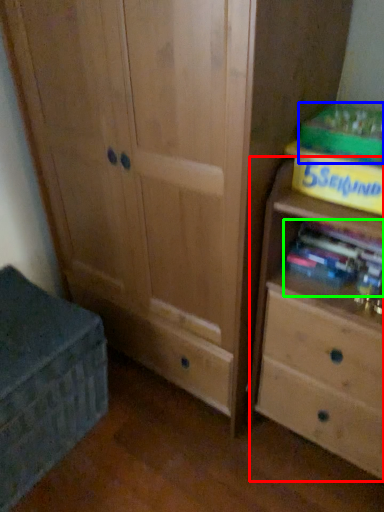
Question: Considering the real-world distances, which object is farthest from chest of drawers (highlighted by a red box)? paperback book (highlighted by a blue box) or book (highlighted by a green box)?

Choices:
 (A) paperback book
 (B) book

Answer: (A)